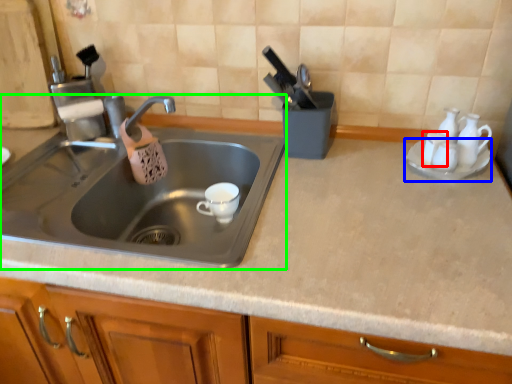
Question: Estimate the real-world distances between objects in this image. Which object is farther from tableware (highlighted by a red box), saucer (highlighted by a blue box) or sink (highlighted by a green box)?

Choices:
 (A) saucer
 (B) sink

Answer: (B)